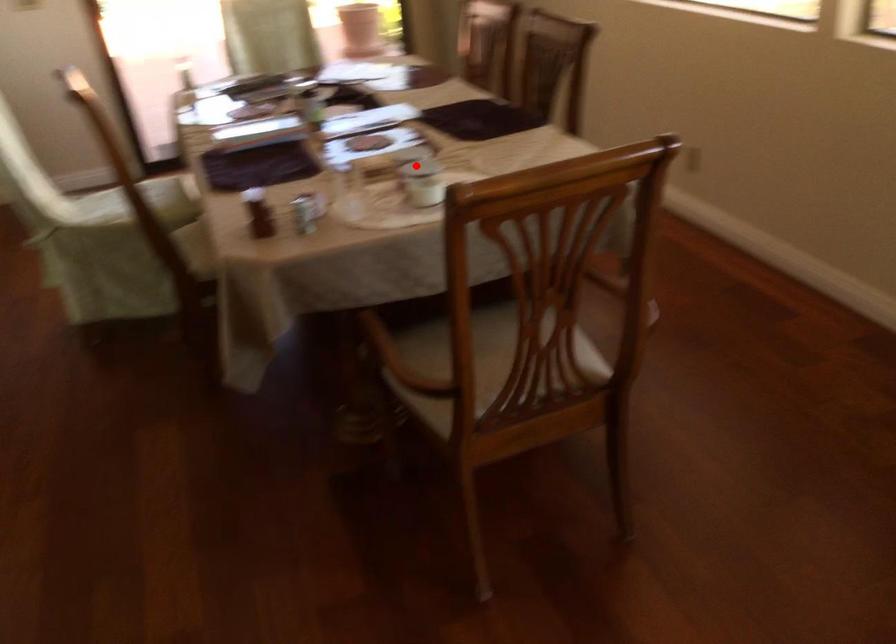
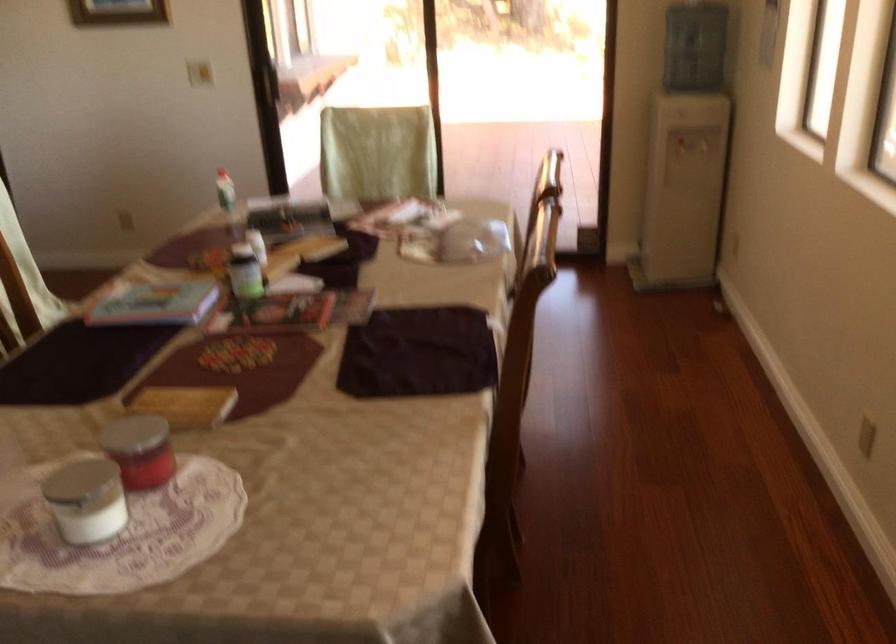
Locate, in the second image, the point that corresponds to the highlighted location in the first image.

(149, 458)